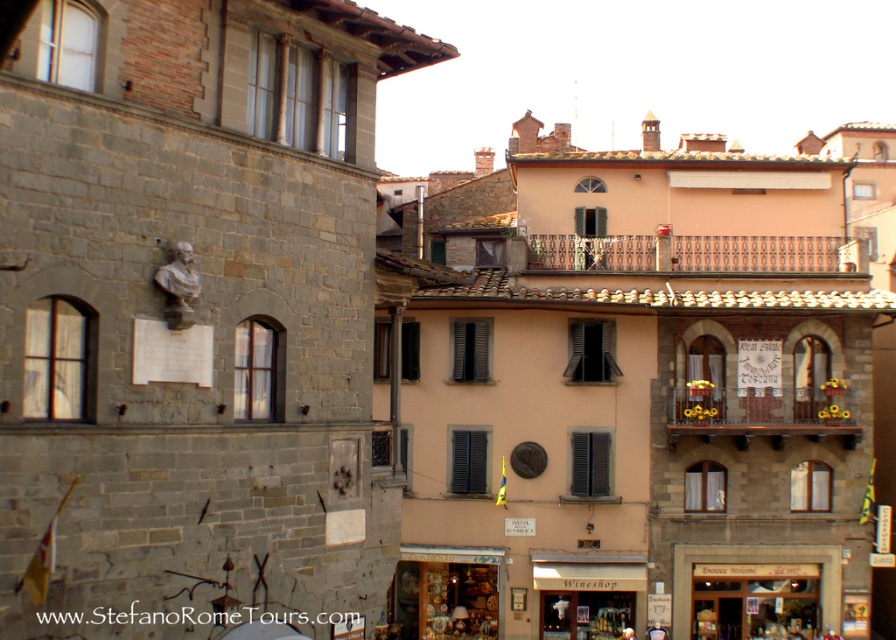
Can you confirm if matte ceramic shop at center is bigger than matte brown wooden wine shop at center?

Yes.

Who is shorter, matte ceramic shop at center or matte brown wooden wine shop at center?

matte brown wooden wine shop at center

Is point (475, 582) positioned in front of point (548, 572)?

No, (475, 582) is behind (548, 572).

I want to click on matte ceramic shop at center, so click(x=444, y=595).

Between matte ceramic shop at center and wooden door at lower right, which one has less height?

With less height is wooden door at lower right.

In the scene shown: Between matte ceramic shop at center and wooden door at lower right, which one is positioned lower?

Positioned lower is matte ceramic shop at center.

Locate an element on the screen. matte ceramic shop at center is located at coordinates (444, 595).

I want to click on matte ceramic shop at center, so click(444, 595).

Is matte brown wooden wine shop at center thinner than wooden door at lower right?

Incorrect, matte brown wooden wine shop at center's width is not less than wooden door at lower right's.

Is matte brown wooden wine shop at center positioned at the back of wooden door at lower right?

No, it is not.

Does point (642, 568) lie behind point (828, 563)?

That is False.

At what (x,y) coordinates should I click in order to perform the action: click on matte brown wooden wine shop at center. Please return your answer as a coordinate pair (x, y). This screenshot has height=640, width=896. Looking at the image, I should click on (586, 596).